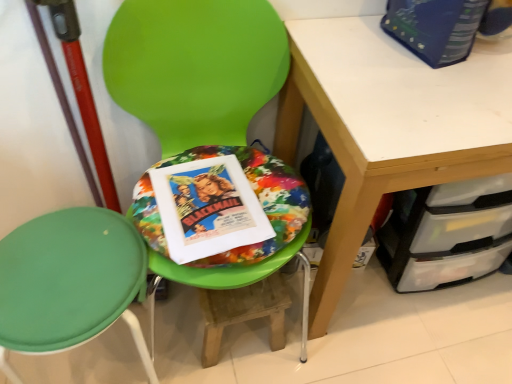
Question: Considering the relative sizes of wooden step stool at center and matte paper movie poster at center, which appears as the 1th paperback book when viewed from the left, in the image provided, is wooden step stool at center smaller than matte paper movie poster at center, which appears as the 1th paperback book when viewed from the left,?

Choices:
 (A) yes
 (B) no

Answer: (B)

Question: Could matte paper movie poster at center, the 2th paperback book from the right, be considered to be inside wooden step stool at center?

Choices:
 (A) yes
 (B) no

Answer: (B)

Question: Is wooden step stool at center completely or partially outside of matte paper movie poster at center, which appears as the 1th paperback book when viewed from the left?

Choices:
 (A) no
 (B) yes

Answer: (B)

Question: From a real-world perspective, is wooden step stool at center over matte paper movie poster at center, the 2th paperback book from the right?

Choices:
 (A) no
 (B) yes

Answer: (A)

Question: Does wooden step stool at center have a lesser height compared to matte paper movie poster at center, the 2th paperback book viewed from the top?

Choices:
 (A) no
 (B) yes

Answer: (A)

Question: From the image's perspective, does wooden step stool at center appear lower than matte paper movie poster at center, the 2th paperback book from the right?

Choices:
 (A) yes
 (B) no

Answer: (A)

Question: Is green fabric chair at center, the first chair viewed from the left, surrounded by green plastic chair at center, which appears as the 2th chair when viewed from the left?

Choices:
 (A) yes
 (B) no

Answer: (B)

Question: Does green plastic chair at center, which appears as the 2th chair when viewed from the left, have a smaller size compared to green fabric chair at center, acting as the 2th chair starting from the right?

Choices:
 (A) yes
 (B) no

Answer: (B)

Question: From a real-world perspective, does green plastic chair at center, which is the first chair from right to left, sit lower than green fabric chair at center, the first chair viewed from the left?

Choices:
 (A) yes
 (B) no

Answer: (B)

Question: Is green fabric chair at center, acting as the 2th chair starting from the right, at the back of green plastic chair at center, which is the first chair from right to left?

Choices:
 (A) yes
 (B) no

Answer: (B)

Question: Is green plastic chair at center, which appears as the 2th chair when viewed from the left, shorter than green fabric chair at center, acting as the 2th chair starting from the right?

Choices:
 (A) yes
 (B) no

Answer: (B)

Question: Is the position of green plastic chair at center, which is the first chair from right to left, less distant than that of green fabric chair at center, the first chair viewed from the left?

Choices:
 (A) no
 (B) yes

Answer: (B)

Question: Is green plastic chair at center, which is the first chair from right to left, not inside wooden step stool at center?

Choices:
 (A) no
 (B) yes

Answer: (B)